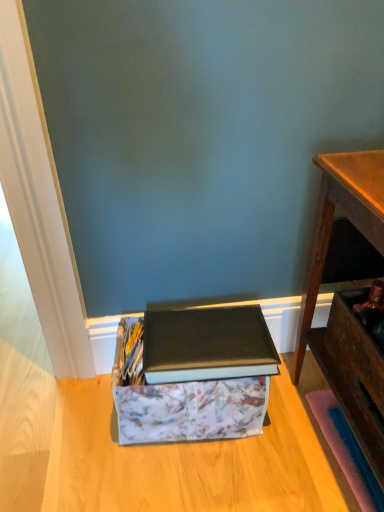
Question: From a real-world perspective, relative to floral fabric storage box at lower center, is wooden drawer at lower right vertically above or below?

Choices:
 (A) above
 (B) below

Answer: (A)

Question: Is wooden drawer at lower right wider or thinner than floral fabric storage box at lower center?

Choices:
 (A) thin
 (B) wide

Answer: (A)

Question: Estimate the real-world distances between objects in this image. Which object is farther from the floral fabric storage box at lower center?

Choices:
 (A) wooden desk at right
 (B) wooden drawer at lower right
 (C) matte black book at center

Answer: (B)

Question: Which object is positioned closest to the wooden drawer at lower right?

Choices:
 (A) wooden desk at right
 (B) matte black book at center
 (C) floral fabric storage box at lower center

Answer: (A)